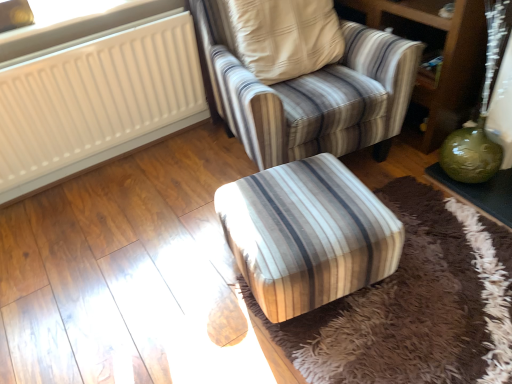
Describe the element at coordinates (479, 193) in the screenshot. I see `green glossy vase at right` at that location.

Describe the element at coordinates (443, 55) in the screenshot. I see `green glossy vase at lower right` at that location.

At what (x,y) coordinates should I click in order to perform the action: click on white matte radiator at upper left. Please return your answer as a coordinate pair (x, y). The image size is (512, 384). Looking at the image, I should click on (97, 101).

Where is `green glossy vase at right`? The image size is (512, 384). green glossy vase at right is located at coordinates (479, 193).

In the scene shown: From the image's perspective, which is below, striped fabric armchair at center or green glossy vase at lower right?

From the image's view, striped fabric armchair at center is below.

Is striped fabric armchair at center smaller than green glossy vase at lower right?

Incorrect, striped fabric armchair at center is not smaller in size than green glossy vase at lower right.

In the scene shown: How different are the orientations of striped fabric armchair at center and green glossy vase at lower right in degrees?

striped fabric armchair at center and green glossy vase at lower right are facing 76.5 degrees away from each other.

From a real-world perspective, is striped fabric armchair at center beneath green glossy vase at lower right?

No, from a real-world perspective, striped fabric armchair at center is not below green glossy vase at lower right.

From a real-world perspective, between white matte radiator at upper left and white plastic radiator at upper left, who is vertically higher?

white plastic radiator at upper left, from a real-world perspective.

Who is more distant, white matte radiator at upper left or white plastic radiator at upper left?

white plastic radiator at upper left is further from the camera.

Measure the distance between white matte radiator at upper left and white plastic radiator at upper left.

They are 24.35 centimeters apart.

Which of these two, white matte radiator at upper left or white plastic radiator at upper left, stands taller?

white matte radiator at upper left.

From a real-world perspective, which object stands above the other?

green glass vase at right, from a real-world perspective.

Is striped fabric ottoman at center bigger or smaller than green glass vase at right?

Clearly, striped fabric ottoman at center is larger in size than green glass vase at right.

Is the surface of striped fabric ottoman at center in direct contact with green glass vase at right?

No, striped fabric ottoman at center is not next to green glass vase at right.

You are a GUI agent. You are given a task and a screenshot of the screen. Output one action in this format:
    pyautogui.click(x=<x>, y=<y>)
    Task: Click on the glass vase behind the striped fabric ottoman at center
    
    Given the screenshot: What is the action you would take?
    [479, 118]

In terms of height, does green glass vase at right look taller or shorter compared to white plastic radiator at upper left?

Clearly, green glass vase at right is taller compared to white plastic radiator at upper left.

Is green glass vase at right in front of or behind white plastic radiator at upper left in the image?

green glass vase at right is positioned closer to the viewer than white plastic radiator at upper left.

Is green glass vase at right positioned with its back to white plastic radiator at upper left?

green glass vase at right is not turned away from white plastic radiator at upper left.

Can you tell me how much striped fabric armchair at center and green glass vase at right differ in facing direction?

They differ by 79.1 degrees in their facing directions.

Is striped fabric armchair at center not within green glass vase at right?

striped fabric armchair at center lies outside green glass vase at right's area.

From the picture: Which object is closer to the camera, striped fabric armchair at center or green glass vase at right?

green glass vase at right is in front.

In the scene shown: From the image's perspective, is striped fabric armchair at center above or below green glass vase at right?

striped fabric armchair at center is situated higher than green glass vase at right in the image.

Is the position of striped fabric ottoman at center more distant than that of green glossy vase at lower right?

No, it is not.

Is striped fabric ottoman at center oriented away from green glossy vase at lower right?

No, striped fabric ottoman at center's orientation is not away from green glossy vase at lower right.

From the picture: Is green glossy vase at lower right completely or partially inside striped fabric ottoman at center?

No.

Looking at this image, based on their positions, is striped fabric ottoman at center located to the left or right of green glossy vase at lower right?

striped fabric ottoman at center is to the left of green glossy vase at lower right.

Is striped fabric ottoman at center looking in the opposite direction of white plastic radiator at upper left?

No, striped fabric ottoman at center is not facing away from white plastic radiator at upper left.

Does striped fabric ottoman at center appear on the right side of white plastic radiator at upper left?

Correct, you'll find striped fabric ottoman at center to the right of white plastic radiator at upper left.

Is striped fabric ottoman at center surrounding white plastic radiator at upper left?

No, striped fabric ottoman at center does not contain white plastic radiator at upper left.

The height and width of the screenshot is (384, 512). I want to click on dresser above the striped fabric armchair at center (from the image's perspective), so click(443, 55).

The width and height of the screenshot is (512, 384). What are the coordinates of `radiator below the white plastic radiator at upper left (from the image's perspective)` in the screenshot? It's located at (97, 101).

From the image, which object appears to be nearer to white matte radiator at upper left, green glass vase at right or striped fabric armchair at center?

The object closer to white matte radiator at upper left is striped fabric armchair at center.

Considering their positions, is green glass vase at right positioned closer to striped fabric armchair at center than white matte radiator at upper left?

green glass vase at right is closer to striped fabric armchair at center.

Based on the photo, considering their positions, is green glossy vase at right positioned further to white matte radiator at upper left than green glass vase at right?

green glossy vase at right.

Which object lies further to the anchor point green glossy vase at right, striped fabric armchair at center or striped fabric ottoman at center?

The object further to green glossy vase at right is striped fabric ottoman at center.

Looking at the image, which one is located further to striped fabric ottoman at center, striped fabric armchair at center or white plastic radiator at upper left?

The object further to striped fabric ottoman at center is white plastic radiator at upper left.

Based on their spatial positions, is striped fabric ottoman at center or striped fabric armchair at center further from green glossy vase at lower right?

Among the two, striped fabric ottoman at center is located further to green glossy vase at lower right.

When comparing their distances from white matte radiator at upper left, does striped fabric armchair at center or white plastic radiator at upper left seem closer?

white plastic radiator at upper left.

Which object lies nearer to the anchor point green glossy vase at lower right, green glass vase at right or white plastic radiator at upper left?

green glass vase at right is closer to green glossy vase at lower right.

This screenshot has height=384, width=512. In order to click on dresser situated between white plastic radiator at upper left and green glossy vase at right from left to right in this screenshot , I will do `click(443, 55)`.

The width and height of the screenshot is (512, 384). I want to click on dresser between striped fabric armchair at center and green glass vase at right in the horizontal direction, so click(x=443, y=55).

This screenshot has width=512, height=384. I want to click on glass vase located between white matte radiator at upper left and green glossy vase at right in the left-right direction, so click(x=479, y=118).

Locate an element on the screen. window screen located between white matte radiator at upper left and green glossy vase at lower right in the left-right direction is located at coordinates (79, 28).